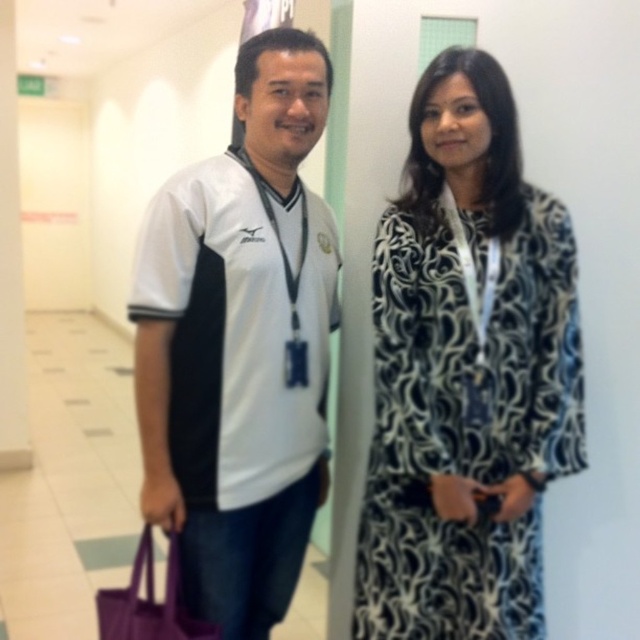
You are standing in a hallway and see the white jersey at center. If you want to reach it, how many steps do you need to take if each step is 1.5 feet?

The distance between you and the white jersey at center is 4.57 feet. Since each step is 1.5 feet, you would need approximately 3 steps to reach it.

You are a photographer setting up a photo shoot in the hallway. You need to position a 1.8m tall backdrop behind both the white jersey at left and the black and white patterned dress at right. Will the backdrop be tall enough to cover both individuals?

The white jersey at left is taller than the black and white patterned dress at right. Since the backdrop is 1.8m tall, it will be sufficient to cover both individuals as the backdrop is taller than both of them.